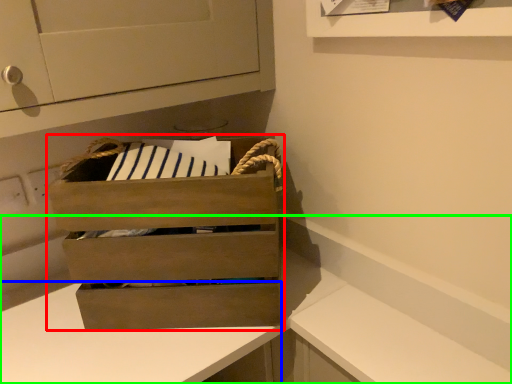
Question: Considering the real-world distances, which object is farthest from chest of drawers (highlighted by a red box)? counter (highlighted by a blue box) or counter (highlighted by a green box)?

Choices:
 (A) counter
 (B) counter

Answer: (B)